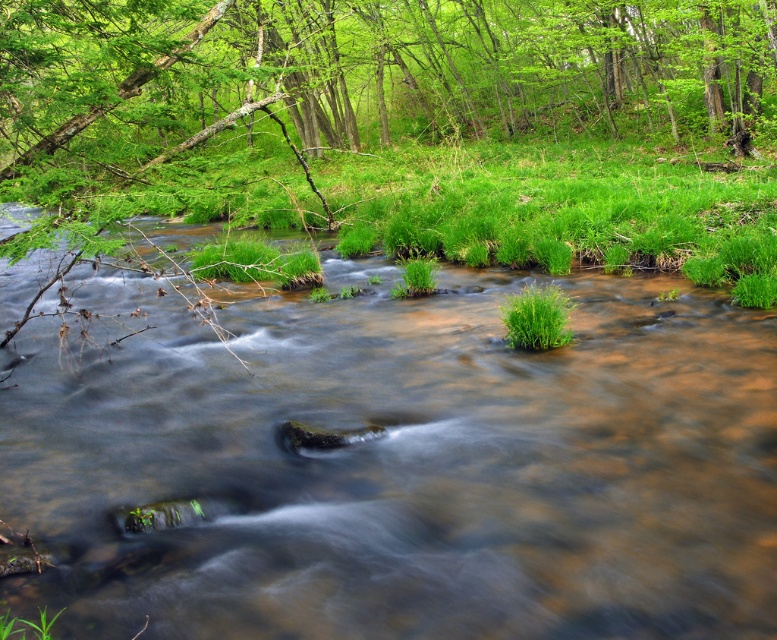
You are a hiker standing at the edge of the stream. You want to place a small picnic basket on the green leafy grass at center without it getting wet. Is the green leafy tree at upper center blocking the area where you want to place it?

The green leafy tree at upper center is positioned over the green leafy grass at center, so placing the picnic basket there might result in it being under the tree. However, since the grass itself is not submerged in water, the basket would remain dry as long as it is placed on the grass away from the stream.

You are a hiker trying to cross the stream. You see the brown muddy stream at center and the green leafy grass at center. Which one is more to the left?

The brown muddy stream at center is positioned on the left side of green leafy grass at center, so the brown muddy stream at center is more to the left.